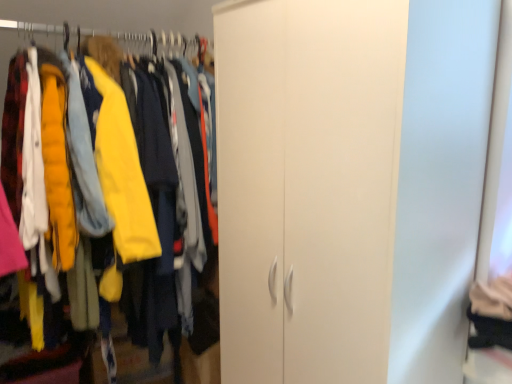
Describe the element at coordinates (148, 39) in the screenshot. The image size is (512, 384). I see `yellow fabric hanger at upper left` at that location.

Identify the location of yellow fabric hanger at upper left. This screenshot has width=512, height=384. (148, 39).

Describe the element at coordinates (115, 157) in the screenshot. I see `white matte cabinet at center` at that location.

Identify the location of white matte cabinet at center. (115, 157).

The width and height of the screenshot is (512, 384). In order to click on yellow fabric hanger at upper left in this screenshot , I will do `click(148, 39)`.

In the scene shown: Is yellow fabric hanger at upper left to the left of white matte cabinet at center from the viewer's perspective?

Yes.

Which object is further away from the camera taking this photo, yellow fabric hanger at upper left or white matte cabinet at center?

yellow fabric hanger at upper left.

Does point (194, 39) lie behind point (98, 85)?

Yes, point (194, 39) is behind point (98, 85).

From the image's perspective, between yellow fabric hanger at upper left and white matte cabinet at center, who is located below?

white matte cabinet at center, from the image's perspective.

From a real-world perspective, is yellow fabric hanger at upper left positioned above or below white matte cabinet at center?

In terms of real-world spatial position, yellow fabric hanger at upper left is above white matte cabinet at center.

Considering the sizes of yellow fabric hanger at upper left and white matte cabinet at center in the image, is yellow fabric hanger at upper left wider or thinner than white matte cabinet at center?

yellow fabric hanger at upper left is thinner than white matte cabinet at center.

Does yellow fabric hanger at upper left have a greater height compared to white matte cabinet at center?

Incorrect, the height of yellow fabric hanger at upper left is not larger of that of white matte cabinet at center.

Considering the sizes of objects yellow fabric hanger at upper left and white matte cabinet at center in the image provided, who is bigger, yellow fabric hanger at upper left or white matte cabinet at center?

With larger size is white matte cabinet at center.

From the picture: Is yellow fabric hanger at upper left spatially inside white matte cabinet at center, or outside of it?

yellow fabric hanger at upper left is spatially positioned inside white matte cabinet at center.

Is yellow fabric hanger at upper left next to white matte cabinet at center?

yellow fabric hanger at upper left and white matte cabinet at center are not in contact.

Is yellow fabric hanger at upper left aimed at white matte cabinet at center?

Yes, yellow fabric hanger at upper left is turned towards white matte cabinet at center.

Image resolution: width=512 pixels, height=384 pixels. In order to click on closet in front of the yellow fabric hanger at upper left in this screenshot , I will do `click(115, 157)`.

Considering the positions of objects white matte cabinet at center and yellow fabric hanger at upper left in the image provided, who is more to the left, white matte cabinet at center or yellow fabric hanger at upper left?

yellow fabric hanger at upper left is more to the left.

Which is in front, white matte cabinet at center or yellow fabric hanger at upper left?

Positioned in front is white matte cabinet at center.

Is point (124, 159) farther from camera compared to point (151, 35)?

That is False.

From the image's perspective, between white matte cabinet at center and yellow fabric hanger at upper left, which one is located above?

yellow fabric hanger at upper left appears higher in the image.

Based on the photo, from a real-world perspective, is white matte cabinet at center under yellow fabric hanger at upper left?

Yes.

Does white matte cabinet at center have a greater width compared to yellow fabric hanger at upper left?

Correct, the width of white matte cabinet at center exceeds that of yellow fabric hanger at upper left.

Is white matte cabinet at center taller or shorter than yellow fabric hanger at upper left?

Considering their sizes, white matte cabinet at center has more height than yellow fabric hanger at upper left.

Is white matte cabinet at center bigger or smaller than yellow fabric hanger at upper left?

Considering their sizes, white matte cabinet at center takes up more space than yellow fabric hanger at upper left.

Is yellow fabric hanger at upper left completely or partially inside white matte cabinet at center?

That's correct, yellow fabric hanger at upper left is inside white matte cabinet at center.

Would you say white matte cabinet at center is a long distance from yellow fabric hanger at upper left?

white matte cabinet at center is actually quite close to yellow fabric hanger at upper left.

Is white matte cabinet at center oriented away from yellow fabric hanger at upper left?

No, white matte cabinet at center is not facing the opposite direction of yellow fabric hanger at upper left.

How distant is white matte cabinet at center from yellow fabric hanger at upper left?

A distance of 18.30 inches exists between white matte cabinet at center and yellow fabric hanger at upper left.

The height and width of the screenshot is (384, 512). In order to click on hanger above the white matte cabinet at center (from a real-world perspective) in this screenshot , I will do `click(148, 39)`.

Find the location of a particular element. closet located below the yellow fabric hanger at upper left (from the image's perspective) is located at coordinates (115, 157).

Find the location of a particular element. The width and height of the screenshot is (512, 384). hanger located on the left of white matte cabinet at center is located at coordinates (148, 39).